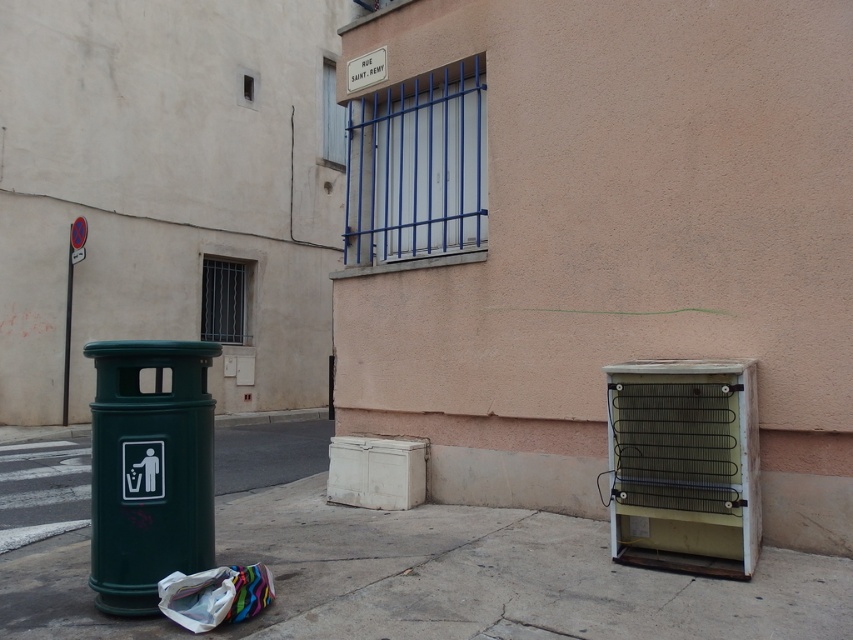
You are a delivery person trying to place a package on the ground near the green plastic trash can at left. According to the scene, can you place the package on the concrete at lower center without moving the trash can?

The concrete at lower center is positioned under green plastic trash can at left, so the package can be placed on the concrete at lower center since it is located underneath the trash can.

You are standing on the sidewalk in front of the building. You see the concrete at lower center and the green plastic trash can at left. Which object is closer to you?

The concrete at lower center is closer to you because the green plastic trash can at left is behind it.

You are a delivery person who needs to park your bike between the concrete at lower center and the green plastic trash can at left. Can you fit your bike there if it requires 1 meter of space?

The concrete at lower center is to the right of the green plastic trash can at left, but the distance between them isn not specified in the objects description. Therefore, it is unclear if there is enough space to park the bike.